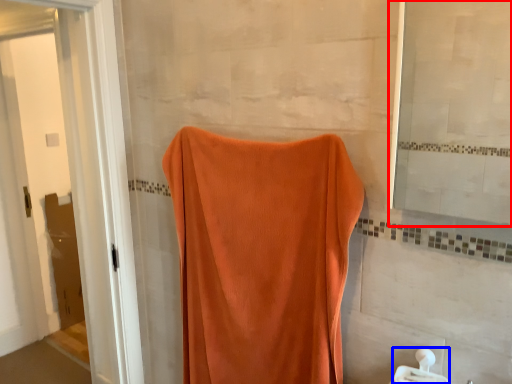
Question: Which object appears farthest to the camera in this image, mirror (highlighted by a red box) or towel bar (highlighted by a blue box)?

Choices:
 (A) mirror
 (B) towel bar

Answer: (B)